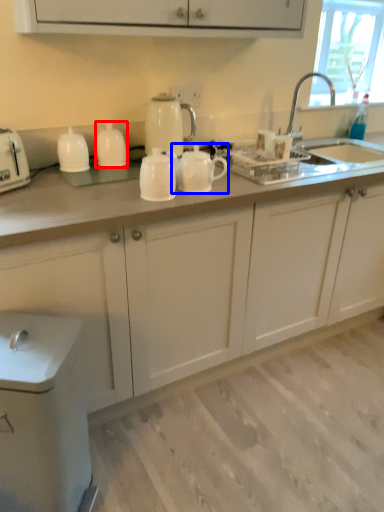
Question: Which point is closer to the camera, tableware (highlighted by a red box) or tea pot (highlighted by a blue box)?

Choices:
 (A) tableware
 (B) tea pot

Answer: (B)